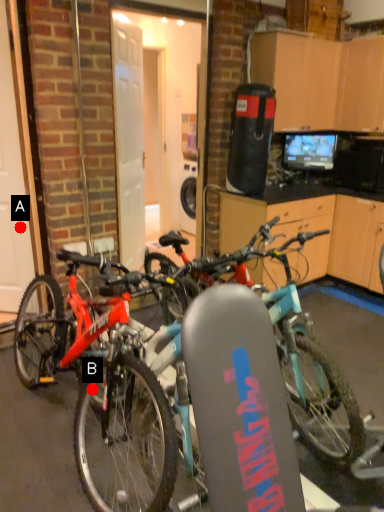
Question: Two points are circled on the image, labeled by A and B beside each circle. Which of the following is the closest to the observer?

Choices:
 (A) A is closer
 (B) B is closer

Answer: (B)